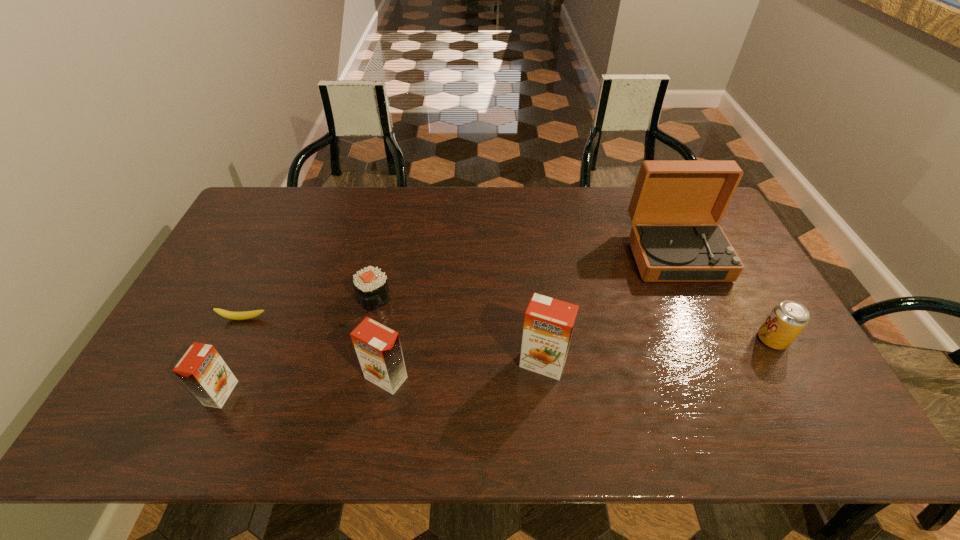
Image resolution: width=960 pixels, height=540 pixels. Identify the location of phonograph record that is at the right edge. (666, 192).

The height and width of the screenshot is (540, 960). What are the coordinates of `pop (soda) situated at the right edge` in the screenshot? It's located at (788, 318).

Locate an element on the screen. This screenshot has width=960, height=540. free space at the far edge is located at coordinates 565,204.

In the image, there is a desktop. At what (x,y) coordinates should I click in order to perform the action: click on vacant space at the near edge. Please return your answer as a coordinate pair (x, y). This screenshot has height=540, width=960. Looking at the image, I should click on (718, 369).

Where is `vacant space at the left edge of the desktop`? The height and width of the screenshot is (540, 960). vacant space at the left edge of the desktop is located at coordinates (205, 318).

The image size is (960, 540). In the image, there is a desktop. Find the location of `vacant region at the far left corner`. vacant region at the far left corner is located at coordinates (291, 186).

The height and width of the screenshot is (540, 960). Identify the location of vacant area that lies between the third shortest object and the banana. (508, 329).

You are a GUI agent. You are given a task and a screenshot of the screen. Output one action in this format:
    pyautogui.click(x=<x>, y=<y>)
    Task: Click on the unoccupied area between the third farthest object and the fifth shortest object
    
    Given the screenshot: What is the action you would take?
    [315, 348]

Identify the location of free spot between the pop (soda) and the leftmost orange juice. (496, 366).

Identify the location of empty location between the fifth object from left to right and the phonograph record. Image resolution: width=960 pixels, height=540 pixels. (610, 309).